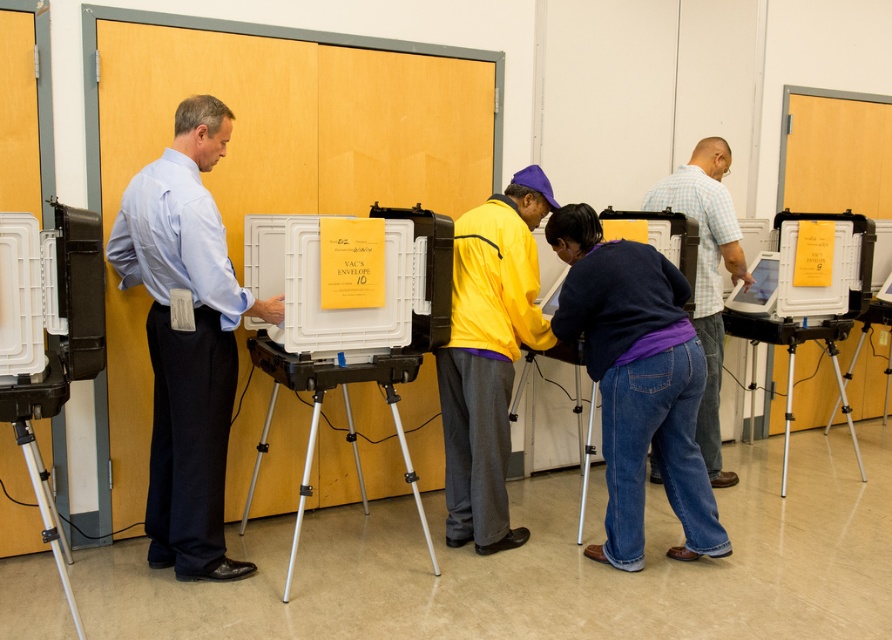
Question: Is light blue shirt at left to the left of denim jeans at center from the viewer's perspective?

Choices:
 (A) no
 (B) yes

Answer: (B)

Question: Which object is the closest to the silver metallic tripod at lower left?

Choices:
 (A) denim jeans at center
 (B) yellow matte jacket at center
 (C) matte purple sweater at center

Answer: (B)

Question: Can you confirm if yellow matte jacket at center is thinner than matte purple sweater at center?

Choices:
 (A) no
 (B) yes

Answer: (B)

Question: Based on their relative distances, which object is nearer to the denim jeans at center?

Choices:
 (A) silver metallic tripod at lower left
 (B) matte purple sweater at center
 (C) yellow matte jacket at center
 (D) light blue shirt at left

Answer: (C)

Question: Among these objects, which one is farthest from the camera?

Choices:
 (A) silver metallic tripod at lower left
 (B) denim jeans at center
 (C) light blue shirt at left

Answer: (B)

Question: Can you confirm if matte purple sweater at center is wider than silver metallic tripod at lower left?

Choices:
 (A) yes
 (B) no

Answer: (A)